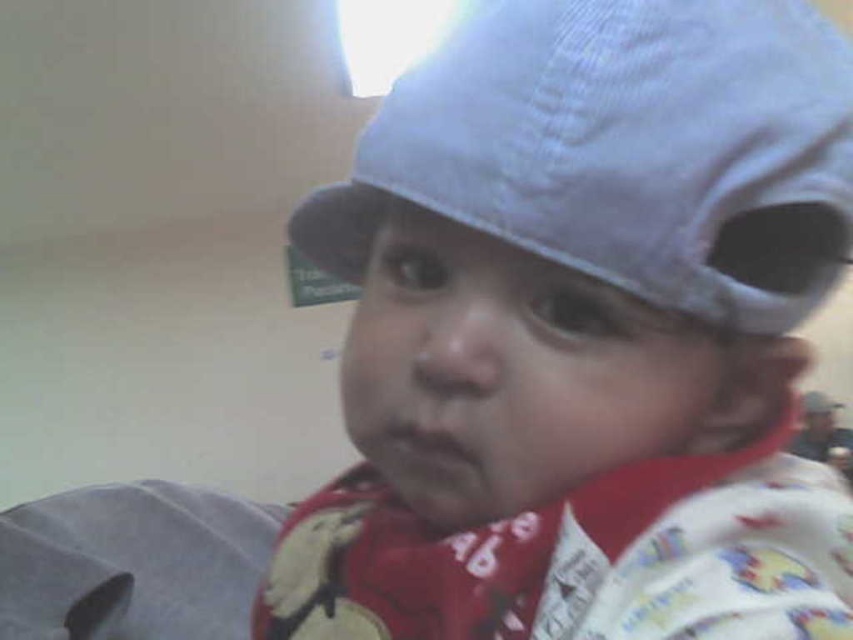
You are a photographer adjusting the focus on your camera. You need to capture both the matte blue cap at center and the blue corduroy baseball cap at upper center in sharp detail. Given their distance apart, can you adjust the camera settings to ensure both are in focus simultaneously?

The matte blue cap at center and blue corduroy baseball cap at upper center are 1.61 inches apart. Since they are very close to each other, adjusting the camera settings to a small aperture like f8 or higher will ensure both are in focus simultaneously.

You are a photographer adjusting the lighting in the room. You notice the matte blue cap at center and the blue corduroy baseball cap at upper center. Which cap is located lower in the image?

The matte blue cap at center is positioned under the blue corduroy baseball cap at upper center, so the matte blue cap at center is lower in the image.

You are a photographer trying to capture the baby wearing the matte blue cap at center and the blue corduroy baseball cap at upper center. Since you want to ensure both caps are visible in the frame, which cap should you position closer to the camera to avoid cropping the wider one?

The matte blue cap at center is wider than the blue corduroy baseball cap at upper center, so you should position the matte blue cap at center closer to the camera to ensure it fits within the frame without being cropped.